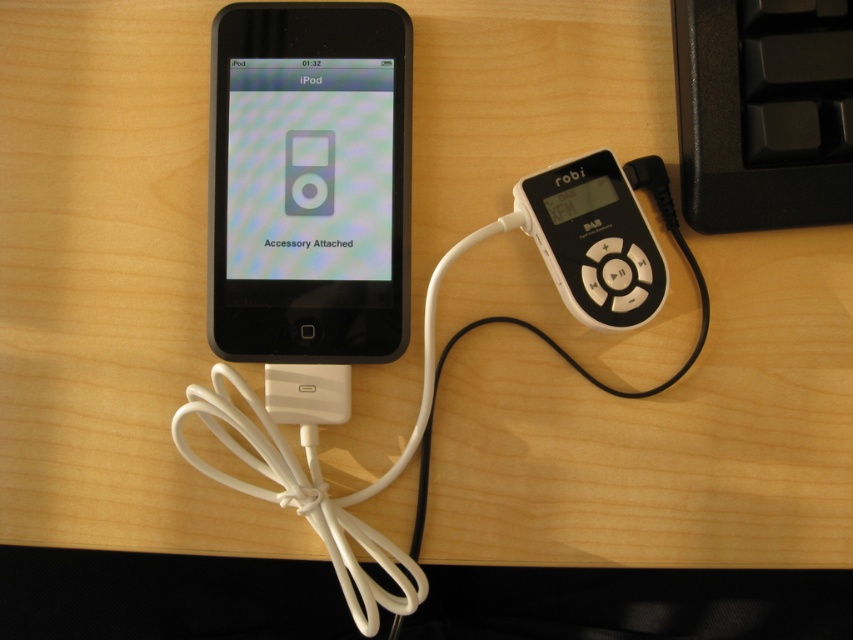
Does black glossy ipod at left appear on the right side of satin black ipod at center?

Indeed, black glossy ipod at left is positioned on the right side of satin black ipod at center.

This screenshot has height=640, width=853. In order to click on black glossy ipod at left in this screenshot , I will do `click(309, 182)`.

The width and height of the screenshot is (853, 640). I want to click on black glossy ipod at left, so click(309, 182).

Does black glossy ipod at left come in front of white plastic cable at center?

No.

Who is more distant from viewer, [248,88] or [520,321]?

Point [520,321]

Identify the location of black glossy ipod at left. (309, 182).

Which is above, black glossy ipod at left or white plastic mp3 player at center-right?

black glossy ipod at left is higher up.

Is black glossy ipod at left positioned before white plastic mp3 player at center-right?

No.

Which is in front, point (316, 129) or point (517, 186)?

Positioned in front is point (517, 186).

Locate an element on the screen. black glossy ipod at left is located at coordinates (309, 182).